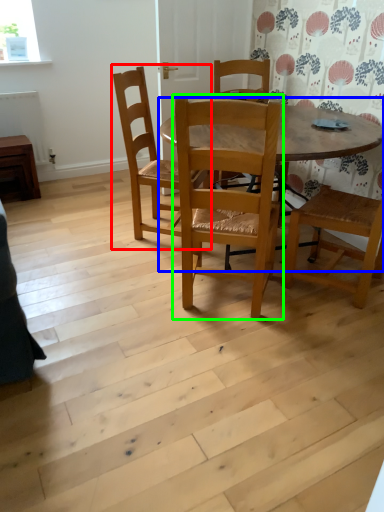
Question: Estimate the real-world distances between objects in this image. Which object is closer to chair (highlighted by a red box), kitchen & dining room table (highlighted by a blue box) or chair (highlighted by a green box)?

Choices:
 (A) kitchen & dining room table
 (B) chair

Answer: (B)